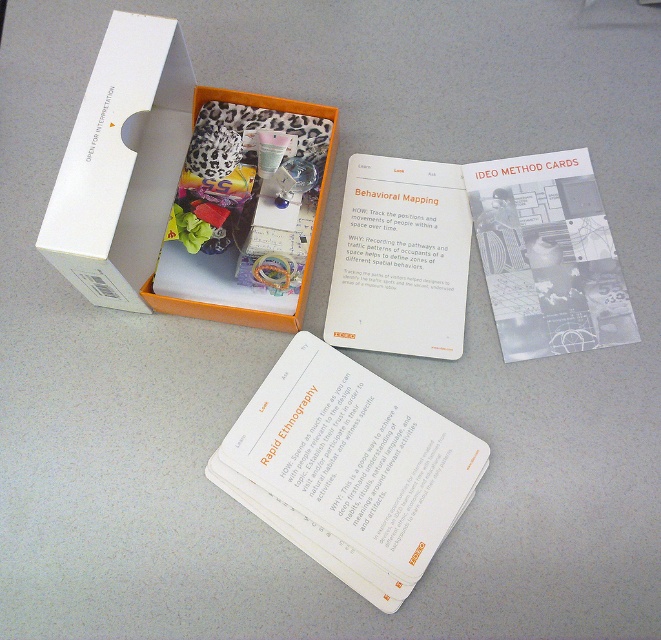
Can you confirm if white paper cards at center is bigger than white cardboard box at upper left?

Actually, white paper cards at center might be smaller than white cardboard box at upper left.

Between white paper cards at center and white cardboard box at upper left, which one appears on the left side from the viewer's perspective?

From the viewer's perspective, white cardboard box at upper left appears more on the left side.

Is point (342, 512) positioned before point (178, 35)?

Yes, it is.

Locate an element on the screen. This screenshot has width=661, height=640. white paper cards at center is located at coordinates (350, 468).